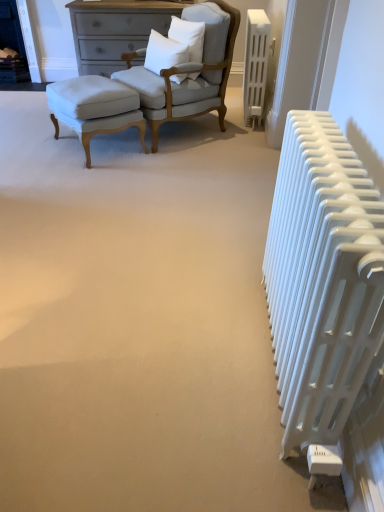
Question: Is the position of white plastic radiator at right, which appears as the first radiator when ordered from the bottom, more distant than that of white plastic radiator at upper right, which appears as the first radiator when viewed from the top?

Choices:
 (A) no
 (B) yes

Answer: (A)

Question: Is white plastic radiator at right, which appears as the first radiator when ordered from the bottom, oriented towards white plastic radiator at upper right, positioned as the first radiator in back-to-front order?

Choices:
 (A) no
 (B) yes

Answer: (A)

Question: Can you confirm if white plastic radiator at right, which is the second radiator from top to bottom, is thinner than white plastic radiator at upper right, which ranks as the 2th radiator in bottom-to-top order?

Choices:
 (A) no
 (B) yes

Answer: (A)

Question: Does white plastic radiator at right, which ranks as the second radiator in back-to-front order, have a larger size compared to white plastic radiator at upper right, positioned as the first radiator in back-to-front order?

Choices:
 (A) yes
 (B) no

Answer: (A)

Question: Is white plastic radiator at upper right, which ranks as the 2th radiator in bottom-to-top order, located within white plastic radiator at right, which ranks as the second radiator in back-to-front order?

Choices:
 (A) no
 (B) yes

Answer: (A)

Question: Is white plastic radiator at right, which ranks as the second radiator in back-to-front order, located outside white plastic radiator at upper right, the 2th radiator when ordered from front to back?

Choices:
 (A) yes
 (B) no

Answer: (A)

Question: Is white plastic radiator at right, which is counted as the 1th radiator, starting from the front, positioned with its back to matte white fabric chair at upper left?

Choices:
 (A) no
 (B) yes

Answer: (A)

Question: Does white plastic radiator at right, which is the second radiator from top to bottom, have a lesser height compared to matte white fabric chair at upper left?

Choices:
 (A) yes
 (B) no

Answer: (A)

Question: From the image's perspective, is white plastic radiator at right, which is the second radiator from top to bottom, on matte white fabric chair at upper left?

Choices:
 (A) no
 (B) yes

Answer: (A)

Question: Is white plastic radiator at right, which is the second radiator from top to bottom, directly adjacent to matte white fabric chair at upper left?

Choices:
 (A) yes
 (B) no

Answer: (B)

Question: Is white plastic radiator at right, which is the second radiator from top to bottom, positioned far away from matte white fabric chair at upper left?

Choices:
 (A) yes
 (B) no

Answer: (A)

Question: Would you say white plastic radiator at right, which is the second radiator from top to bottom, contains matte white fabric chair at upper left?

Choices:
 (A) no
 (B) yes

Answer: (A)

Question: Could you tell me if white soft pillow at center, which is the first pillow from left to right, is facing white plastic radiator at upper right, positioned as the first radiator in back-to-front order?

Choices:
 (A) yes
 (B) no

Answer: (B)